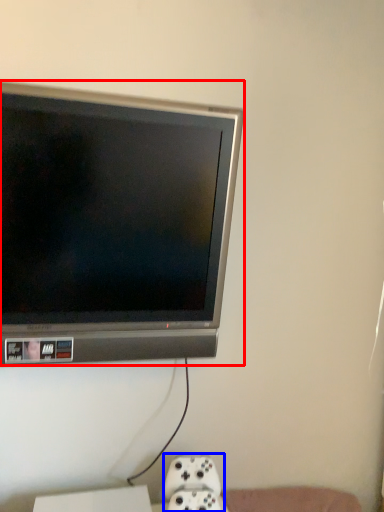
Question: Which of the following is the closest to the observer, television (highlighted by a red box) or game controller (highlighted by a blue box)?

Choices:
 (A) television
 (B) game controller

Answer: (A)